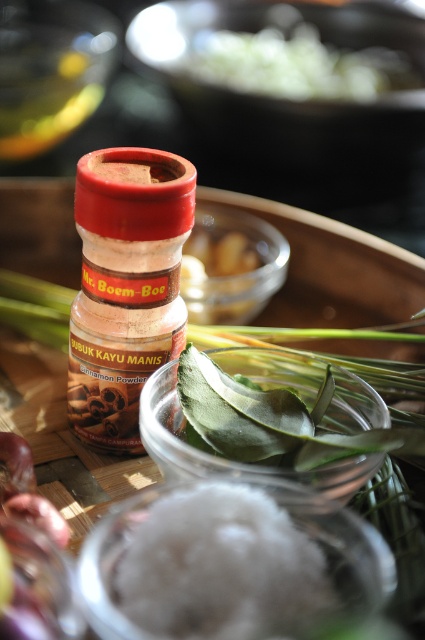
Question: Can you confirm if green leafy at center is positioned to the left of green leafy vegetable at upper center?

Choices:
 (A) no
 (B) yes

Answer: (B)

Question: Which of the following is the farthest from the observer?

Choices:
 (A) (135, 589)
 (B) (190, 420)

Answer: (B)

Question: Which is farther from the green leafy vegetable at upper center?

Choices:
 (A) green leafy at center
 (B) white fluffy powder at center

Answer: (B)

Question: Which of the following is the farthest from the observer?

Choices:
 (A) green leafy at center
 (B) white fluffy powder at center

Answer: (A)

Question: Is green leafy at center below green leafy vegetable at upper center?

Choices:
 (A) no
 (B) yes

Answer: (B)

Question: Is white fluffy powder at center to the right of green leafy at center from the viewer's perspective?

Choices:
 (A) yes
 (B) no

Answer: (B)